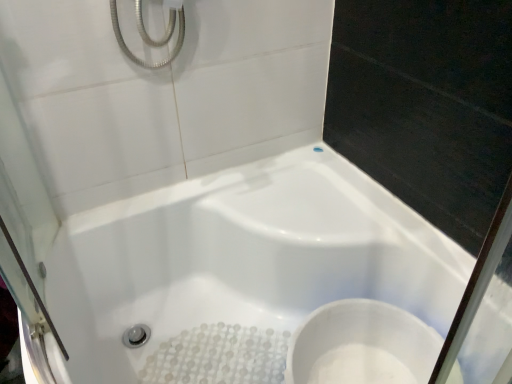
Question: Is white glossy bathtub at center smaller than white glossy toilet at lower right?

Choices:
 (A) no
 (B) yes

Answer: (A)

Question: Can you confirm if white glossy bathtub at center is thinner than white glossy toilet at lower right?

Choices:
 (A) yes
 (B) no

Answer: (B)

Question: Can you confirm if white glossy bathtub at center is bigger than white glossy toilet at lower right?

Choices:
 (A) yes
 (B) no

Answer: (A)

Question: Is white glossy bathtub at center next to white glossy toilet at lower right?

Choices:
 (A) no
 (B) yes

Answer: (A)

Question: Is white glossy bathtub at center in front of white glossy toilet at lower right?

Choices:
 (A) no
 (B) yes

Answer: (B)

Question: Is white glossy bathtub at center positioned far away from white glossy toilet at lower right?

Choices:
 (A) no
 (B) yes

Answer: (A)

Question: Is white glossy toilet at lower right in contact with white glossy bathtub at center?

Choices:
 (A) yes
 (B) no

Answer: (B)

Question: From the image's perspective, is white glossy toilet at lower right located above white glossy bathtub at center?

Choices:
 (A) yes
 (B) no

Answer: (B)

Question: From a real-world perspective, is white glossy toilet at lower right positioned under white glossy bathtub at center based on gravity?

Choices:
 (A) no
 (B) yes

Answer: (A)

Question: Considering the relative sizes of white glossy toilet at lower right and white glossy bathtub at center in the image provided, is white glossy toilet at lower right taller than white glossy bathtub at center?

Choices:
 (A) no
 (B) yes

Answer: (A)

Question: Considering the relative sizes of white glossy toilet at lower right and white glossy bathtub at center in the image provided, is white glossy toilet at lower right bigger than white glossy bathtub at center?

Choices:
 (A) yes
 (B) no

Answer: (B)

Question: Is the depth of white glossy toilet at lower right less than that of white glossy bathtub at center?

Choices:
 (A) yes
 (B) no

Answer: (B)

Question: In the image, is white glossy toilet at lower right on the left side or the right side of white glossy bathtub at center?

Choices:
 (A) right
 (B) left

Answer: (A)